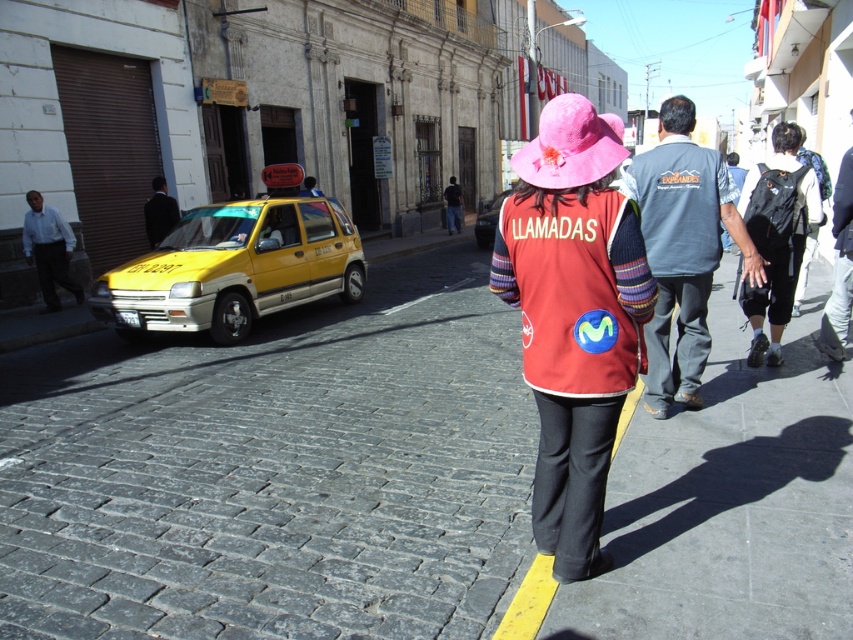
Question: Which point is farther from the camera taking this photo?

Choices:
 (A) (107, 300)
 (B) (552, 140)

Answer: (A)

Question: From the image, what is the correct spatial relationship of matte red vest at center in relation to black matte backpack at right?

Choices:
 (A) below
 (B) above

Answer: (A)

Question: Does cobblestone pavement at center have a larger size compared to gray fabric shirt at center?

Choices:
 (A) yes
 (B) no

Answer: (A)

Question: Can you confirm if pink fabric hat at center is positioned to the right of dark suit jacket at left?

Choices:
 (A) yes
 (B) no

Answer: (A)

Question: Which point is farther to the camera?

Choices:
 (A) matte red vest at center
 (B) gray fabric shirt at center
 (C) dark suit jacket at left
 (D) matte black shirt at center

Answer: (D)

Question: Considering the real-world distances, which object is closest to the red matte vest at center?

Choices:
 (A) dark suit jacket at left
 (B) matte red vest at center
 (C) denim jacket at right
 (D) matte black shirt at center

Answer: (B)